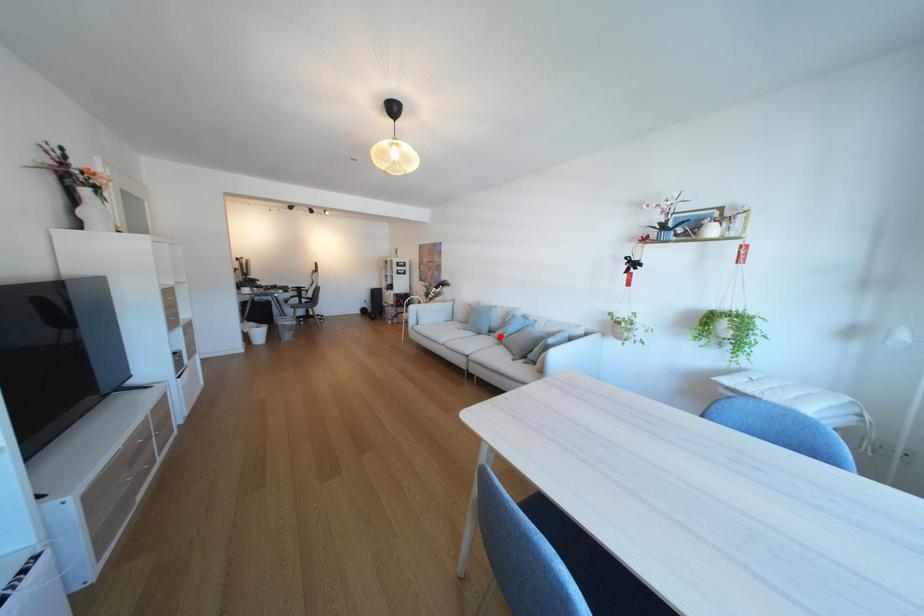
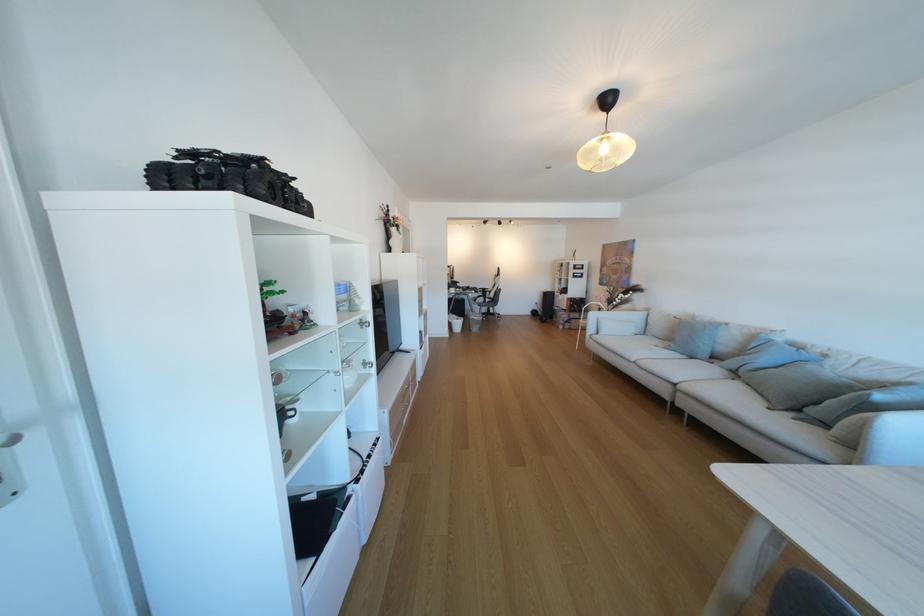
Locate, in the second image, the point that corresponds to the highlighted location in the first image.

(723, 363)